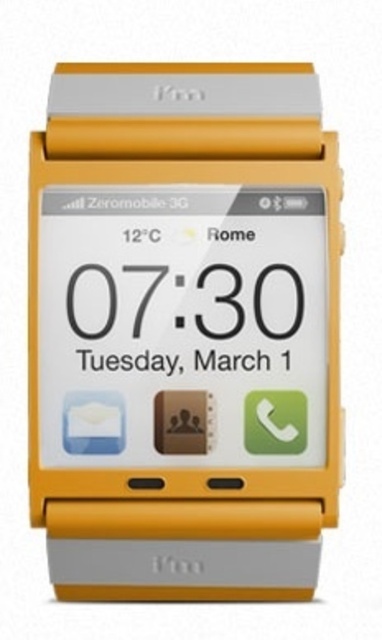
You are looking at a smartwatch and notice two objects on its display. One is the yellow matte smartwatch at center and the other is the black glossy clock face at center. Which object is located to the right of the other?

The yellow matte smartwatch at center is positioned on the right side of black glossy clock face at center.

You are holding a yellow matte smartwatch at center and want to check the time displayed on the black glossy clock face at center. Can you easily read the time without moving the watch?

The yellow matte smartwatch at center is closer to the viewer than the black glossy clock face at center, so the clock face might be partially obscured, making it difficult to read the time without moving the watch.